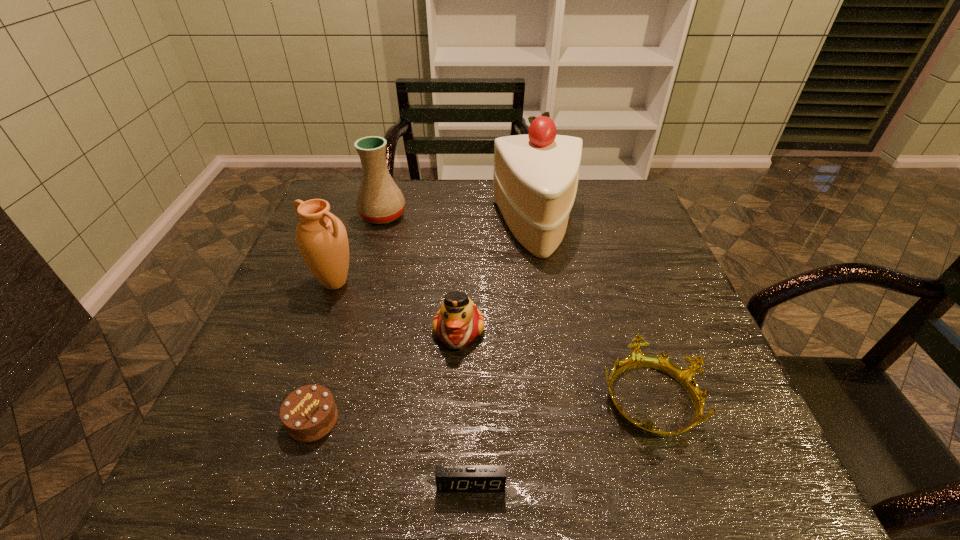
Identify the location of urn that is at the left edge. (321, 237).

In order to click on chocolate cake that is at the left edge in this screenshot , I will do `click(309, 413)`.

Where is `object that is at the right edge`? The image size is (960, 540). object that is at the right edge is located at coordinates (685, 376).

Where is `object present at the far left corner`? This screenshot has width=960, height=540. object present at the far left corner is located at coordinates (379, 200).

Identify the location of object at the near right corner. The width and height of the screenshot is (960, 540). 685,376.

Where is `vacant space at the far edge`? Image resolution: width=960 pixels, height=540 pixels. vacant space at the far edge is located at coordinates (404, 198).

This screenshot has width=960, height=540. Identify the location of free location at the near edge. (434, 449).

Locate an element on the screen. The image size is (960, 540). vacant space at the left edge of the desktop is located at coordinates (296, 269).

Identify the location of vacant space at the right edge of the desktop. The width and height of the screenshot is (960, 540). (x=642, y=275).

Identify the location of blank space at the far right corner. (x=641, y=205).